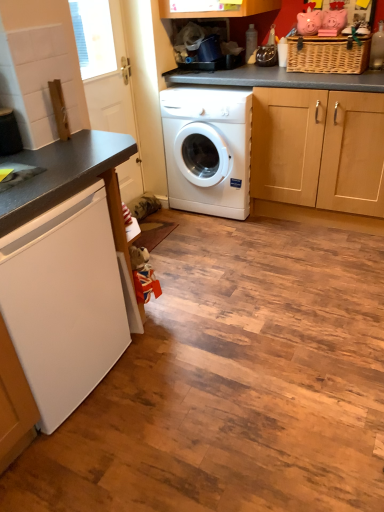
Image resolution: width=384 pixels, height=512 pixels. Find the location of `free space in front of white matte refrigerator at lower left, positioned as the 2th washing machine in top-to-bottom order`. free space in front of white matte refrigerator at lower left, positioned as the 2th washing machine in top-to-bottom order is located at coordinates (85, 462).